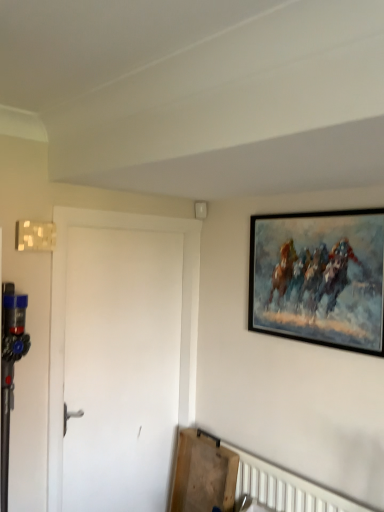
Describe the element at coordinates (121, 368) in the screenshot. I see `white matte door at left` at that location.

You are a GUI agent. You are given a task and a screenshot of the screen. Output one action in this format:
    pyautogui.click(x=<x>, y=<y>)
    Task: Click on the white matte door at left
    
    Given the screenshot: What is the action you would take?
    pyautogui.click(x=121, y=368)

The image size is (384, 512). In order to click on black framed painting at upper right in this screenshot , I will do `click(319, 278)`.

The image size is (384, 512). Describe the element at coordinates (319, 278) in the screenshot. I see `black framed painting at upper right` at that location.

Locate an element on the screen. This screenshot has height=512, width=384. white matte door at left is located at coordinates tap(121, 368).

Considering the relative positions of black framed painting at upper right and white matte door at left in the image provided, is black framed painting at upper right to the right of white matte door at left from the viewer's perspective?

Yes.

Is black framed painting at upper right in front of or behind white matte door at left in the image?

black framed painting at upper right is positioned closer to the viewer than white matte door at left.

Is point (335, 289) positioned in front of point (108, 369)?

That is True.

From the image's perspective, is black framed painting at upper right located above or below white matte door at left?

From the image's perspective, black framed painting at upper right appears above white matte door at left.

From a real-world perspective, is black framed painting at upper right physically located above or below white matte door at left?

Clearly, from a real-world perspective, black framed painting at upper right is above white matte door at left.

Considering the relative sizes of black framed painting at upper right and white matte door at left in the image provided, is black framed painting at upper right thinner than white matte door at left?

Indeed, black framed painting at upper right has a lesser width compared to white matte door at left.

Considering the sizes of objects black framed painting at upper right and white matte door at left in the image provided, who is taller, black framed painting at upper right or white matte door at left?

Standing taller between the two is white matte door at left.

Based on the photo, between black framed painting at upper right and white matte door at left, which one has larger size?

With larger size is white matte door at left.

Is black framed painting at upper right inside the boundaries of white matte door at left, or outside?

black framed painting at upper right is outside white matte door at left.

Is black framed painting at upper right in contact with white matte door at left?

black framed painting at upper right and white matte door at left are clearly separated.

Does black framed painting at upper right turn towards white matte door at left?

No, black framed painting at upper right is not oriented towards white matte door at left.

The height and width of the screenshot is (512, 384). In order to click on door on the left of the black framed painting at upper right in this screenshot , I will do `click(121, 368)`.

Visually, is white matte door at left positioned to the left or to the right of black framed painting at upper right?

Based on their positions, white matte door at left is located to the left of black framed painting at upper right.

Between white matte door at left and black framed painting at upper right, which one is positioned in front?

Positioned in front is black framed painting at upper right.

Between point (81, 333) and point (324, 331), which one is positioned in front?

Positioned in front is point (324, 331).

From the image's perspective, which one is positioned lower, white matte door at left or black framed painting at upper right?

white matte door at left is shown below in the image.

From a real-world perspective, between white matte door at left and black framed painting at upper right, who is vertically lower?

white matte door at left.

Consider the image. Which of these two, white matte door at left or black framed painting at upper right, is thinner?

black framed painting at upper right.

Considering the sizes of objects white matte door at left and black framed painting at upper right in the image provided, who is shorter, white matte door at left or black framed painting at upper right?

black framed painting at upper right is shorter.

Considering the sizes of objects white matte door at left and black framed painting at upper right in the image provided, who is smaller, white matte door at left or black framed painting at upper right?

black framed painting at upper right.

Is black framed painting at upper right a part of white matte door at left?

Definitely not — black framed painting at upper right is not inside white matte door at left.

Would you consider white matte door at left to be distant from black framed painting at upper right?

No, there isn't a large distance between white matte door at left and black framed painting at upper right.

Is white matte door at left oriented away from black framed painting at upper right?

No, white matte door at left is not facing the opposite direction of black framed painting at upper right.

How distant is white matte door at left from black framed painting at upper right?

32.49 inches.

The width and height of the screenshot is (384, 512). I want to click on picture frame in front of the white matte door at left, so click(x=319, y=278).

You are a GUI agent. You are given a task and a screenshot of the screen. Output one action in this format:
    pyautogui.click(x=<x>, y=<y>)
    Task: Click on the picture frame lying on the right of white matte door at left
    This screenshot has height=512, width=384.
    Given the screenshot: What is the action you would take?
    pyautogui.click(x=319, y=278)

Identify the location of picture frame in front of the white matte door at left. The width and height of the screenshot is (384, 512). (319, 278).